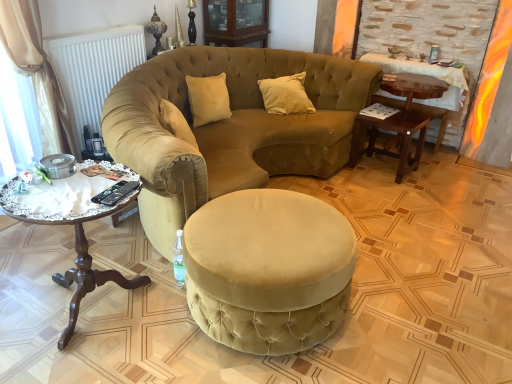
You are a GUI agent. You are given a task and a screenshot of the screen. Output one action in this format:
    pyautogui.click(x=<x>, y=<y>)
    Task: Click on the vacant area to the left of black plastic remote control at lower left
    
    Given the screenshot: What is the action you would take?
    pyautogui.click(x=77, y=185)